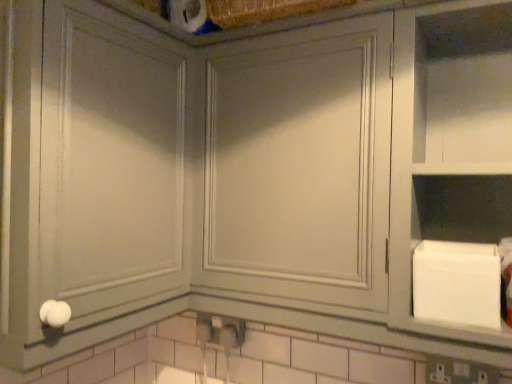
Question: From a real-world perspective, is matte gray cabinet at center, the 1th glass door from the left, positioned under white matte cabinet at right based on gravity?

Choices:
 (A) yes
 (B) no

Answer: (B)

Question: Considering the relative sizes of matte gray cabinet at center, the 1th glass door from the left, and white matte cabinet at right in the image provided, is matte gray cabinet at center, the 1th glass door from the left, bigger than white matte cabinet at right?

Choices:
 (A) no
 (B) yes

Answer: (B)

Question: Does matte gray cabinet at center, the 2th glass door when ordered from right to left, have a lesser height compared to white matte cabinet at right?

Choices:
 (A) yes
 (B) no

Answer: (B)

Question: Is the position of matte gray cabinet at center, the 2th glass door when ordered from right to left, more distant than that of white matte cabinet at right?

Choices:
 (A) no
 (B) yes

Answer: (A)

Question: Is matte gray cabinet at center, the 1th glass door from the left, at the left side of white matte cabinet at right?

Choices:
 (A) yes
 (B) no

Answer: (A)

Question: Can you confirm if matte gray cabinet at center, the 2th glass door when ordered from right to left, is positioned to the right of white matte cabinet at right?

Choices:
 (A) yes
 (B) no

Answer: (B)

Question: From a real-world perspective, is matte gray cabinet at center, the first glass door when ordered from right to left, physically above matte gray cabinet at center, the 2th glass door when ordered from right to left?

Choices:
 (A) yes
 (B) no

Answer: (A)

Question: Does matte gray cabinet at center, the first glass door when ordered from right to left, have a lesser width compared to matte gray cabinet at center, the 2th glass door when ordered from right to left?

Choices:
 (A) no
 (B) yes

Answer: (B)

Question: Considering the relative positions of matte gray cabinet at center, which appears as the 2th glass door when viewed from the left, and matte gray cabinet at center, the 2th glass door when ordered from right to left, in the image provided, is matte gray cabinet at center, which appears as the 2th glass door when viewed from the left, to the right of matte gray cabinet at center, the 2th glass door when ordered from right to left, from the viewer's perspective?

Choices:
 (A) no
 (B) yes

Answer: (B)

Question: Considering the relative sizes of matte gray cabinet at center, the first glass door when ordered from right to left, and matte gray cabinet at center, the 2th glass door when ordered from right to left, in the image provided, is matte gray cabinet at center, the first glass door when ordered from right to left, wider than matte gray cabinet at center, the 2th glass door when ordered from right to left,?

Choices:
 (A) no
 (B) yes

Answer: (A)

Question: From the image's perspective, would you say matte gray cabinet at center, the first glass door when ordered from right to left, is shown under matte gray cabinet at center, the 1th glass door from the left?

Choices:
 (A) no
 (B) yes

Answer: (B)

Question: Is matte gray cabinet at center, the first glass door when ordered from right to left, closer to camera compared to matte gray cabinet at center, the 1th glass door from the left?

Choices:
 (A) no
 (B) yes

Answer: (A)

Question: Does white matte cabinet at right have a lesser width compared to matte gray cabinet at center, the first glass door when ordered from right to left?

Choices:
 (A) no
 (B) yes

Answer: (A)